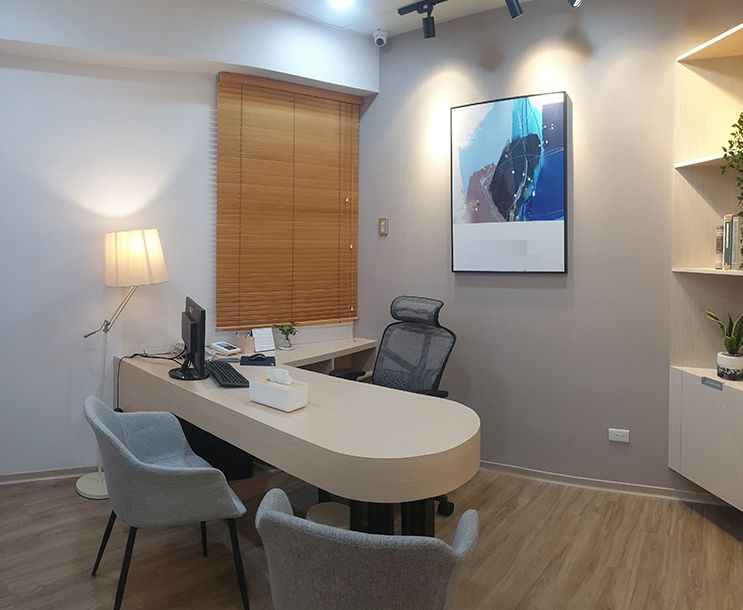
Locate an element on the screen. This screenshot has height=610, width=743. computer mouse is located at coordinates (256, 354).